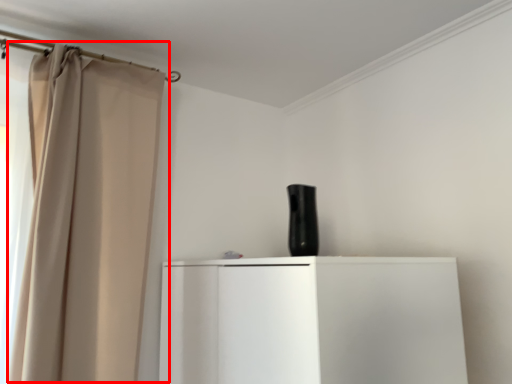
Question: From the image's perspective, what is the correct spatial positioning of curtain (annotated by the red box) in reference to appliance?

Choices:
 (A) below
 (B) above

Answer: (A)